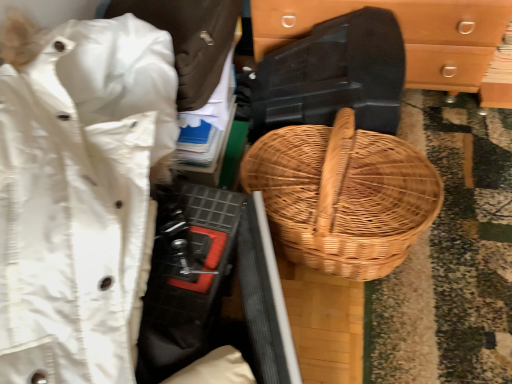
The height and width of the screenshot is (384, 512). Describe the element at coordinates (343, 195) in the screenshot. I see `brown wicker picnic basket at center` at that location.

Find the location of a particular element. This screenshot has width=512, height=384. brown wicker picnic basket at center is located at coordinates (343, 195).

At what (x,y) coordinates should I click in order to perform the action: click on brown wicker picnic basket at center. Please return your answer as a coordinate pair (x, y). Looking at the image, I should click on (343, 195).